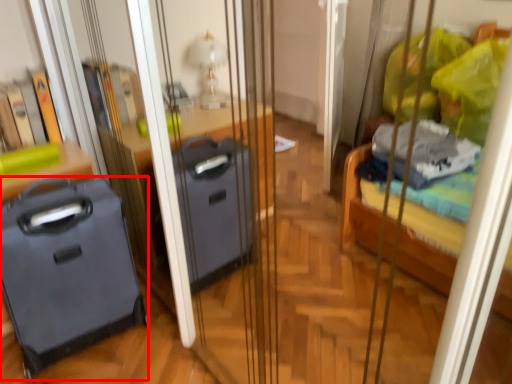
Question: From the image's perspective, considering the relative positions of luggage (annotated by the red box) and furniture in the image provided, where is luggage (annotated by the red box) located with respect to the staircase?

Choices:
 (A) above
 (B) below

Answer: (B)